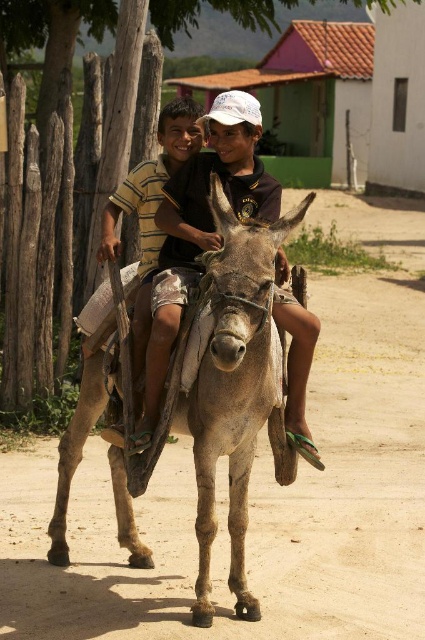
Does gray rough mule at center have a greater width compared to striped cotton shirt at center?

Correct, the width of gray rough mule at center exceeds that of striped cotton shirt at center.

Who is more distant from viewer, (197,376) or (163,116)?

Point (163,116)

Where is `gray rough mule at center`? The height and width of the screenshot is (640, 425). gray rough mule at center is located at coordinates (235, 388).

From the picture: Can you confirm if gray rough mule at center is wider than matte brown donkey at center?

No, gray rough mule at center is not wider than matte brown donkey at center.

Describe the element at coordinates (235, 388) in the screenshot. Image resolution: width=425 pixels, height=640 pixels. I see `gray rough mule at center` at that location.

At what (x,y) coordinates should I click in order to perform the action: click on gray rough mule at center. Please return your answer as a coordinate pair (x, y). The height and width of the screenshot is (640, 425). Looking at the image, I should click on (235, 388).

Does matte brown donkey at center have a smaller size compared to striped cotton shirt at center?

Incorrect, matte brown donkey at center is not smaller in size than striped cotton shirt at center.

Between matte brown donkey at center and striped cotton shirt at center, which one is positioned higher?

striped cotton shirt at center is higher up.

This screenshot has width=425, height=640. I want to click on matte brown donkey at center, so click(x=201, y=227).